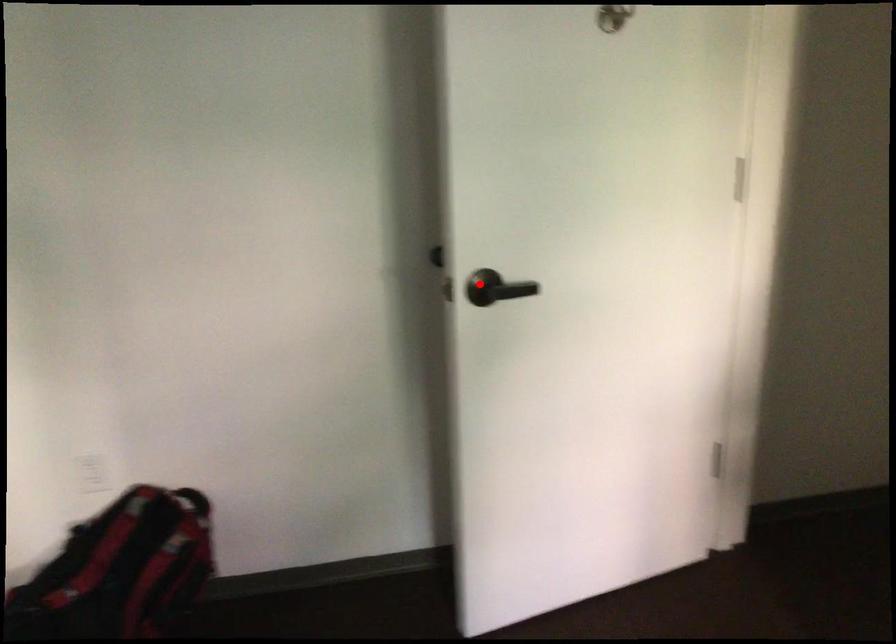
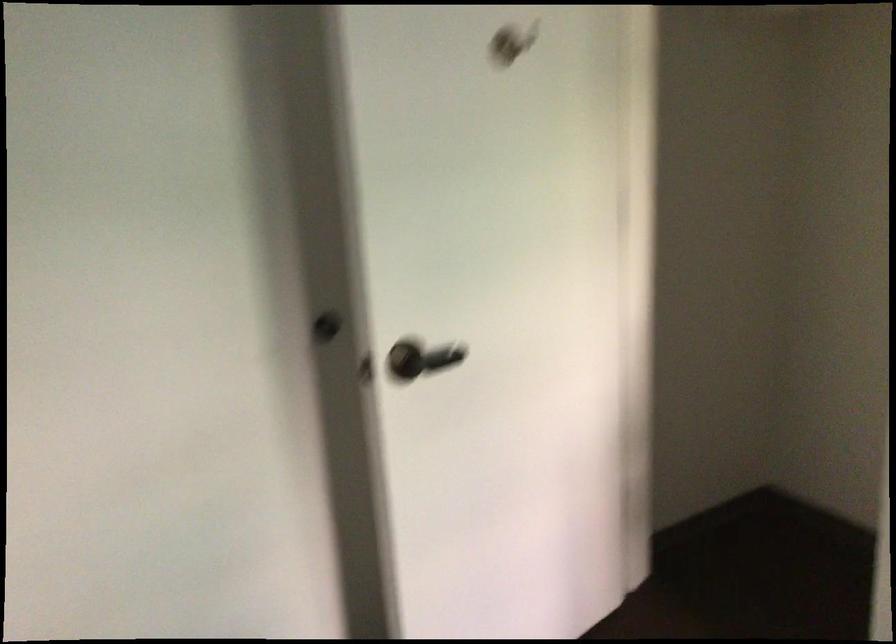
The point at the highlighted location is marked in the first image. Where is the corresponding point in the second image?

(407, 359)